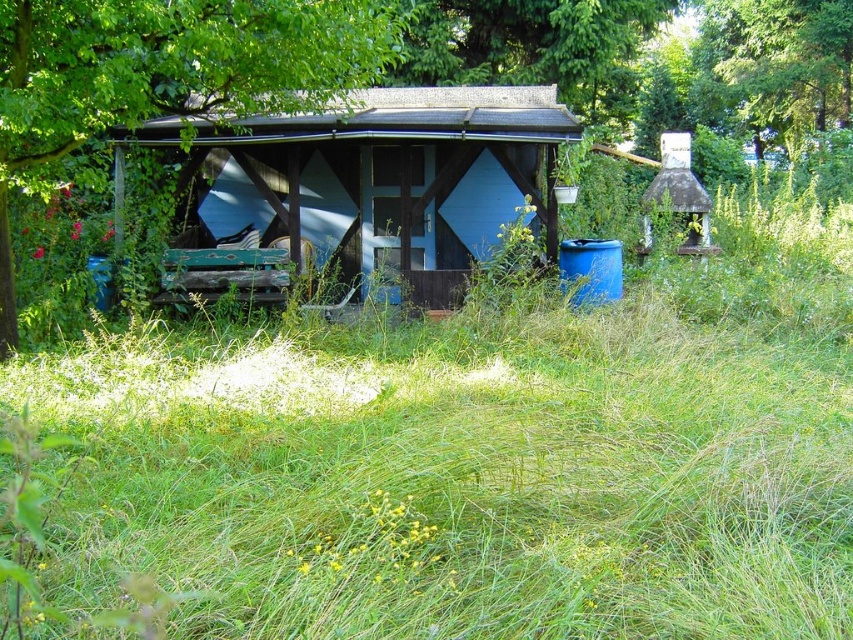
Question: Which point is farther from the camera taking this photo?

Choices:
 (A) (234, 225)
 (B) (27, 68)

Answer: (A)

Question: Does wooden hut at center appear over green leafy tree at upper left?

Choices:
 (A) yes
 (B) no

Answer: (A)

Question: Is wooden hut at center below green leafy tree at upper left?

Choices:
 (A) no
 (B) yes

Answer: (A)

Question: Does wooden hut at center have a smaller size compared to green leafy tree at upper left?

Choices:
 (A) no
 (B) yes

Answer: (B)